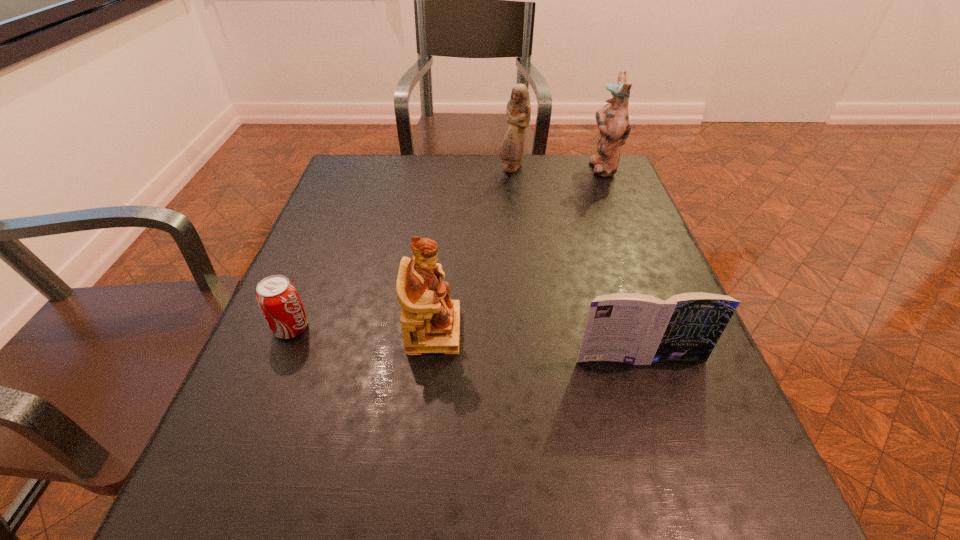
Identify the location of free space between the fourth object from right to left and the third object from left to right. (473, 249).

The height and width of the screenshot is (540, 960). I want to click on free space that is in between the rightmost figurine and the soda, so click(446, 247).

At what (x,y) coordinates should I click in order to perform the action: click on free spot between the third object from right to left and the rightmost figurine. Please return your answer as a coordinate pair (x, y). Image resolution: width=960 pixels, height=540 pixels. Looking at the image, I should click on (557, 168).

Locate an element on the screen. The width and height of the screenshot is (960, 540). vacant area that lies between the soda and the nearest figurine is located at coordinates (363, 329).

I want to click on object that is the closest one to the fourth tallest object, so click(x=430, y=321).

Find the location of a particular element. The image size is (960, 540). the second closest object to the rightmost figurine is located at coordinates (639, 329).

Identify which figurine is located as the second nearest to the soda. Please provide its 2D coordinates. Your answer should be formatted as a tuple, i.e. [(x, y)], where the tuple contains the x and y coordinates of a point satisfying the conditions above.

[(518, 112)]

Select which figurine is the closest to the rightmost figurine. Please provide its 2D coordinates. Your answer should be formatted as a tuple, i.e. [(x, y)], where the tuple contains the x and y coordinates of a point satisfying the conditions above.

[(518, 112)]

I want to click on vacant position in the image that satisfies the following two spatial constraints: 1. on the front-facing side of the rightmost figurine; 2. on the front-facing side of the second figurine from left to right, so click(x=603, y=168).

Find the location of a particular element. vacant space that satisfies the following two spatial constraints: 1. on the front-facing side of the rightmost figurine; 2. on the front-facing side of the second figurine from left to right is located at coordinates (603, 168).